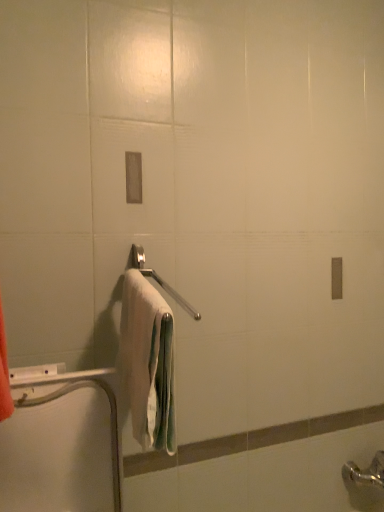
You are a GUI agent. You are given a task and a screenshot of the screen. Output one action in this format:
    pyautogui.click(x=<x>, y=<y>)
    Task: Click on the satin silver towel bar at center
    The width and height of the screenshot is (384, 512).
    Given the screenshot: What is the action you would take?
    pyautogui.click(x=160, y=280)

This screenshot has height=512, width=384. Describe the element at coordinates (160, 280) in the screenshot. I see `satin silver towel bar at center` at that location.

Image resolution: width=384 pixels, height=512 pixels. Identify the location of satin silver towel bar at center. (160, 280).